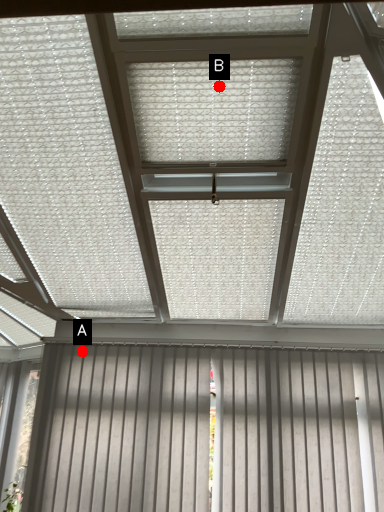
Question: Two points are circled on the image, labeled by A and B beside each circle. Which point appears closest to the camera in this image?

Choices:
 (A) A is closer
 (B) B is closer

Answer: (B)